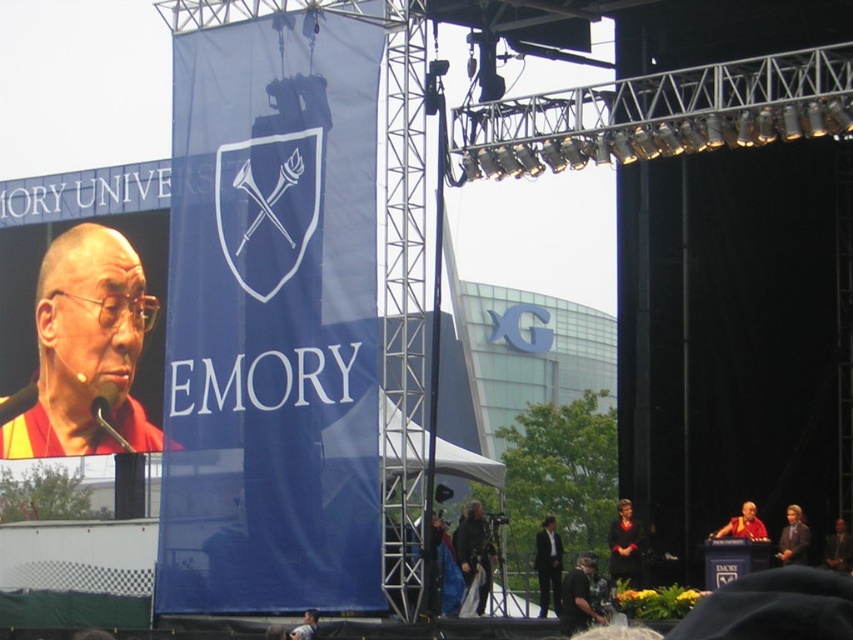
Can you confirm if yellow/yellowish fabric at left is positioned to the right of black suit at center?

In fact, yellow/yellowish fabric at left is to the left of black suit at center.

Who is taller, yellow/yellowish fabric at left or black suit at center?

Standing taller between the two is yellow/yellowish fabric at left.

Does point (119, 429) lie behind point (538, 573)?

That is True.

Find the location of `yellow/yellowish fabric at left`. yellow/yellowish fabric at left is located at coordinates (84, 353).

Between smooth brown suit at lower right and dark brown leather jacket at center, which one has more height?

smooth brown suit at lower right

Between point (804, 552) and point (827, 547), which one is positioned in front?

Point (804, 552) is more forward.

Where is `smooth brown suit at lower right`? smooth brown suit at lower right is located at coordinates (793, 538).

Is point (753, 531) less distant than point (300, 636)?

That is False.

Between point (718, 531) and point (300, 634), which one is positioned in front?

Point (300, 634) is more forward.

Where is `red silk robe at center`? red silk robe at center is located at coordinates (743, 525).